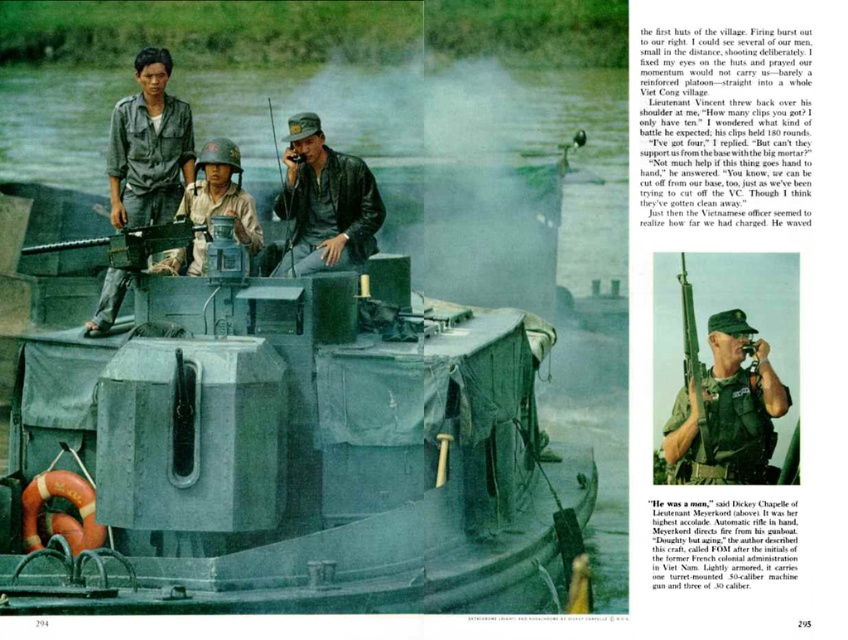
Based on the photo, does green canvas boat at center have a greater height compared to matte black rifle at center?

Yes.

This screenshot has width=848, height=640. What do you see at coordinates (283, 452) in the screenshot?
I see `green canvas boat at center` at bounding box center [283, 452].

Which is behind, point (361, 356) or point (696, 397)?

Point (361, 356)

Find the location of a particular element. This screenshot has width=848, height=640. green canvas boat at center is located at coordinates (283, 452).

Identify the location of camouflage fabric uniform at center. (726, 410).

Locate an element on the screen. Image resolution: width=848 pixels, height=640 pixels. camouflage fabric uniform at center is located at coordinates [726, 410].

Which is above, camouflage fabric uniform at upper left or camouflage fabric helmet at center?

camouflage fabric uniform at upper left is above.

You are a GUI agent. You are given a task and a screenshot of the screen. Output one action in this format:
    pyautogui.click(x=<x>, y=<y>)
    Task: Click on the camouflage fabric uniform at upper left
    
    Given the screenshot: What is the action you would take?
    pyautogui.click(x=148, y=147)